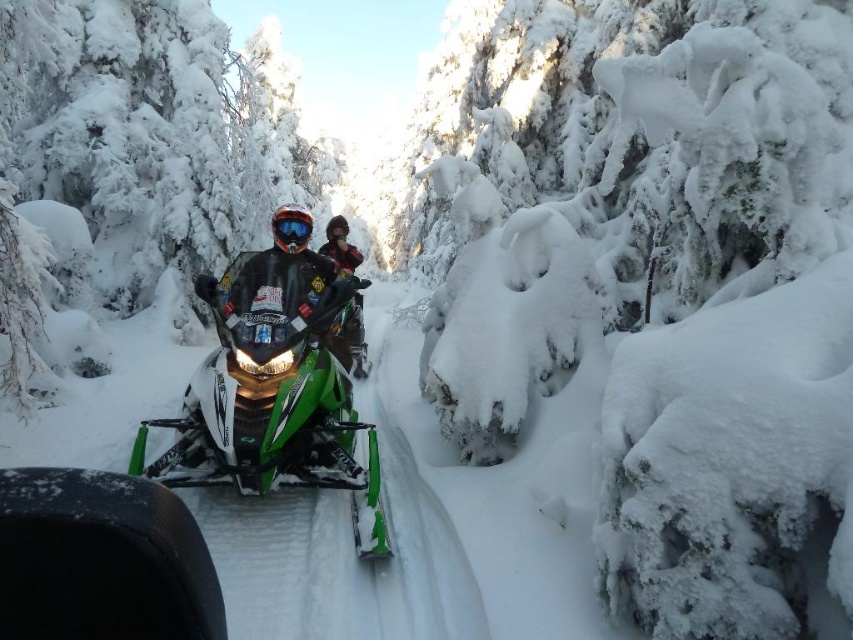
Question: Can you confirm if white frosty tree at center is positioned to the right of shiny black jacket at center?

Choices:
 (A) yes
 (B) no

Answer: (B)

Question: Considering the relative positions of white frosty tree at center and red plaid jacket at center in the image provided, where is white frosty tree at center located with respect to red plaid jacket at center?

Choices:
 (A) below
 (B) above

Answer: (B)

Question: Can you confirm if white frosty tree at center is positioned to the right of shiny black jacket at center?

Choices:
 (A) yes
 (B) no

Answer: (B)

Question: Which object is closer to the camera taking this photo?

Choices:
 (A) red plaid jacket at center
 (B) shiny black jacket at center
 (C) green matte/snowmobile at center
 (D) white frosty tree at center

Answer: (C)

Question: Which is nearer to the red plaid jacket at center?

Choices:
 (A) green matte/snowmobile at center
 (B) shiny black jacket at center

Answer: (B)

Question: Which point appears farthest from the camera in this image?

Choices:
 (A) (213, 26)
 (B) (318, 477)
 (C) (312, 324)
 (D) (357, 317)

Answer: (A)